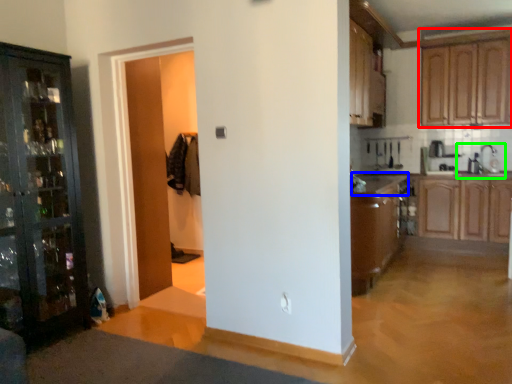
Question: Estimate the real-world distances between objects in this image. Which object is closer to cabinetry (highlighted by a red box), counter top (highlighted by a blue box) or sink (highlighted by a green box)?

Choices:
 (A) counter top
 (B) sink

Answer: (B)